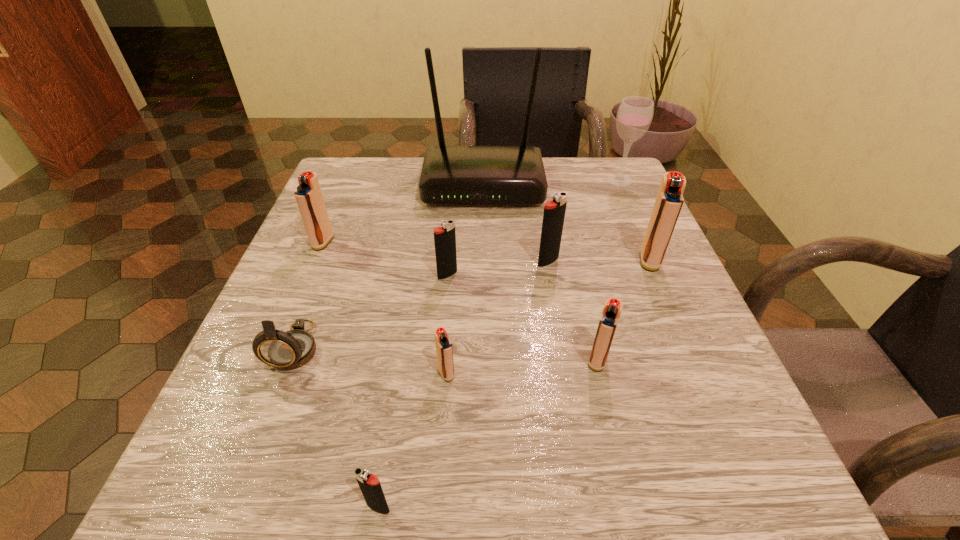
Find the location of a particular element. The width and height of the screenshot is (960, 540). the sixth igniter from left to right is located at coordinates (612, 309).

Identify the location of the second red igniter from right to left. (612, 309).

The height and width of the screenshot is (540, 960). I want to click on compass, so click(288, 350).

Where is `the smallest red igniter`? Image resolution: width=960 pixels, height=540 pixels. the smallest red igniter is located at coordinates (444, 350).

Locate an element on the screen. Image resolution: width=960 pixels, height=540 pixels. the smallest black igniter is located at coordinates (370, 486).

Find the location of `the nearest igniter`. the nearest igniter is located at coordinates (370, 486).

You are a GUI agent. You are given a task and a screenshot of the screen. Output one action in this format:
    pyautogui.click(x=<x>, y=<y>)
    Task: Click on the vacant space located on the front-facing side of the router
    Image resolution: width=960 pixels, height=540 pixels.
    Given the screenshot: What is the action you would take?
    pyautogui.click(x=484, y=284)

The height and width of the screenshot is (540, 960). In order to click on free space located on the left of the wineglass in this screenshot , I will do `click(562, 180)`.

This screenshot has width=960, height=540. In order to click on vacant space positioned 0.130m on the front of the tallest igniter in this screenshot , I will do `click(678, 326)`.

The height and width of the screenshot is (540, 960). What are the coordinates of `free region located on the back of the second biggest red igniter` in the screenshot? It's located at (359, 156).